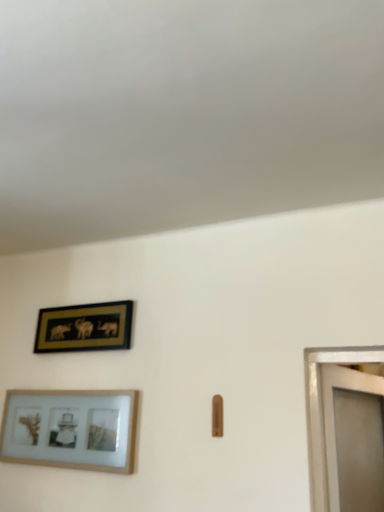
Question: From the image's perspective, is wooden picture frame at lower left, marked as the 1th picture frame in a bottom-to-top arrangement, located beneath gold-framed artwork at upper left, which is the first picture frame from top to bottom?

Choices:
 (A) yes
 (B) no

Answer: (A)

Question: From a real-world perspective, is wooden picture frame at lower left, marked as the 1th picture frame in a bottom-to-top arrangement, on top of gold-framed artwork at upper left, which is the first picture frame from top to bottom?

Choices:
 (A) yes
 (B) no

Answer: (B)

Question: From a real-world perspective, is wooden picture frame at lower left, which is counted as the 2th picture frame, starting from the top, beneath gold-framed artwork at upper left, the second picture frame positioned from the bottom?

Choices:
 (A) no
 (B) yes

Answer: (B)

Question: Is wooden picture frame at lower left, marked as the 1th picture frame in a bottom-to-top arrangement, in contact with gold-framed artwork at upper left, which is the first picture frame from top to bottom?

Choices:
 (A) yes
 (B) no

Answer: (B)

Question: Does wooden picture frame at lower left, which is counted as the 2th picture frame, starting from the top, have a lesser width compared to gold-framed artwork at upper left, the second picture frame positioned from the bottom?

Choices:
 (A) yes
 (B) no

Answer: (B)

Question: Does wooden picture frame at lower left, marked as the 1th picture frame in a bottom-to-top arrangement, have a greater height compared to gold-framed artwork at upper left, the second picture frame positioned from the bottom?

Choices:
 (A) no
 (B) yes

Answer: (B)

Question: Is gold-framed artwork at upper left, the second picture frame positioned from the bottom, wider than wooden picture frame at lower left, which is counted as the 2th picture frame, starting from the top?

Choices:
 (A) yes
 (B) no

Answer: (B)

Question: From the image's perspective, would you say gold-framed artwork at upper left, the second picture frame positioned from the bottom, is shown under wooden picture frame at lower left, marked as the 1th picture frame in a bottom-to-top arrangement?

Choices:
 (A) yes
 (B) no

Answer: (B)

Question: Is gold-framed artwork at upper left, which is the first picture frame from top to bottom, smaller than wooden picture frame at lower left, marked as the 1th picture frame in a bottom-to-top arrangement?

Choices:
 (A) yes
 (B) no

Answer: (A)

Question: Is gold-framed artwork at upper left, which is the first picture frame from top to bottom, to the right of wooden picture frame at lower left, marked as the 1th picture frame in a bottom-to-top arrangement, from the viewer's perspective?

Choices:
 (A) no
 (B) yes

Answer: (B)

Question: Could wooden picture frame at lower left, marked as the 1th picture frame in a bottom-to-top arrangement, be considered to be inside gold-framed artwork at upper left, the second picture frame positioned from the bottom?

Choices:
 (A) no
 (B) yes

Answer: (A)

Question: Does gold-framed artwork at upper left, which is the first picture frame from top to bottom, appear on the left side of wooden picture frame at lower left, marked as the 1th picture frame in a bottom-to-top arrangement?

Choices:
 (A) no
 (B) yes

Answer: (A)

Question: Is wooden picture frame at lower left, marked as the 1th picture frame in a bottom-to-top arrangement, in front of or behind gold-framed artwork at upper left, the second picture frame positioned from the bottom, in the image?

Choices:
 (A) behind
 (B) front

Answer: (B)